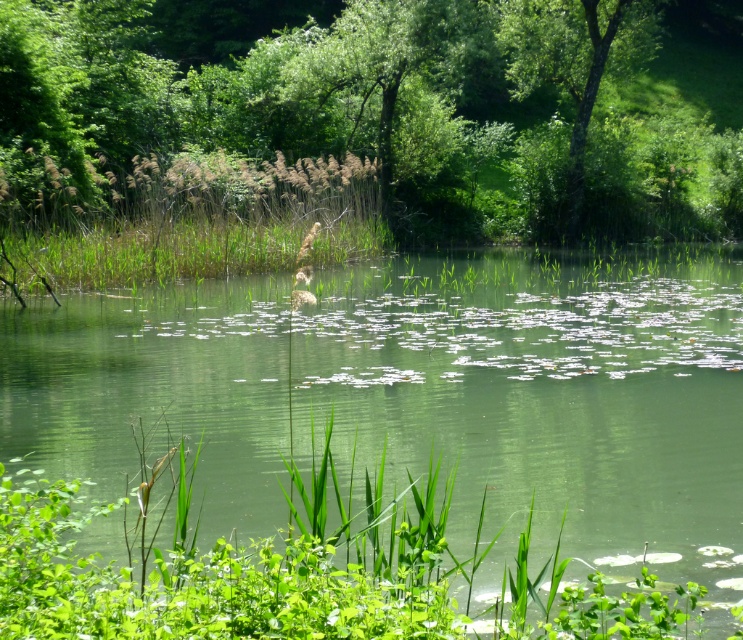
You are standing at the edge of the water in the scene. You want to place a small decorative stone exactly at the center of the green leafy vegetation at center. What are the coordinates where you should place it?

The coordinates for the center of the green leafy vegetation at center are exactly at point [421,397].

You are standing at the edge of the water in the serene natural scene. There is a point marked at coordinates (178, 250). What object is located at that point?

The point at coordinates (178, 250) is occupied by green leafy grass at center.

In the scene shown: You are standing in the serene natural scene by the water. You notice two points marked in the image. Which point, point 1 at coordinates (10, 234) or point 2 at coordinates (603, 36), is closer to you?

Point 1 at coordinates (10, 234) is closer to you than point 2 at coordinates (603, 36).